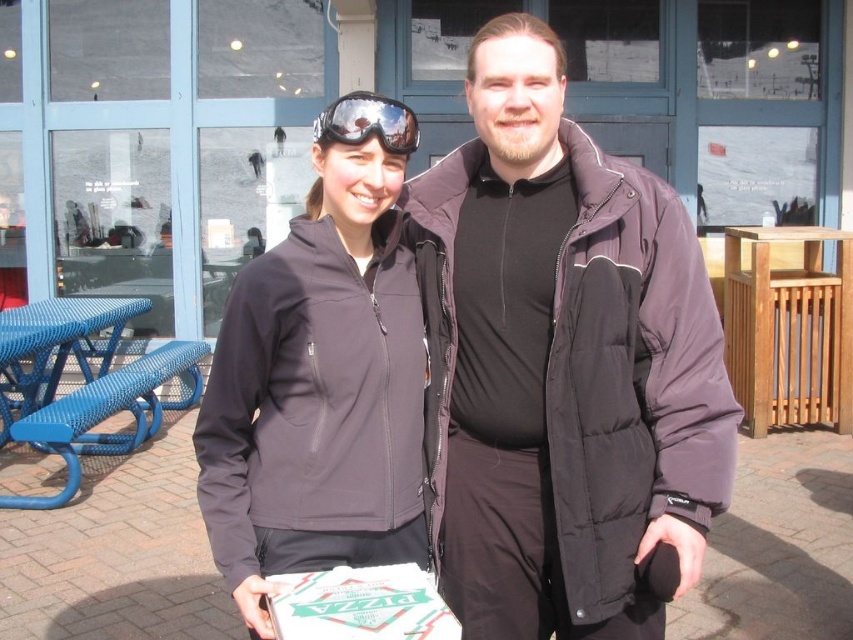
Question: Which object is the farthest from the reflective plastic goggles at center?

Choices:
 (A) blue woven picnic table at left
 (B) purple puffy jacket at center
 (C) dark gray softshell jacket at center

Answer: (A)

Question: Is purple puffy jacket at center wider than dark gray softshell jacket at center?

Choices:
 (A) no
 (B) yes

Answer: (B)

Question: Does purple puffy jacket at center appear on the left side of reflective plastic goggles at center?

Choices:
 (A) yes
 (B) no

Answer: (B)

Question: Which of the following is the farthest from the observer?

Choices:
 (A) (260, 515)
 (B) (44, 449)
 (C) (643, 294)
 (D) (389, 112)

Answer: (B)

Question: Is dark gray softshell jacket at center bigger than reflective plastic goggles at center?

Choices:
 (A) yes
 (B) no

Answer: (A)

Question: Among these objects, which one is farthest from the camera?

Choices:
 (A) reflective plastic goggles at center
 (B) blue woven picnic table at left
 (C) purple puffy jacket at center
 (D) dark gray softshell jacket at center

Answer: (B)